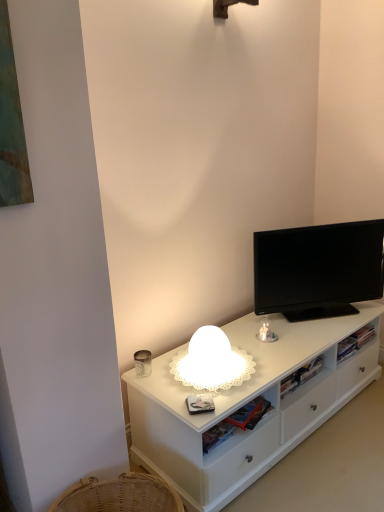
Question: Can you confirm if white matte cabinet at center is taller than white frosted glass lamp at center?

Choices:
 (A) yes
 (B) no

Answer: (B)

Question: Can you confirm if white matte cabinet at center is shorter than white frosted glass lamp at center?

Choices:
 (A) no
 (B) yes

Answer: (B)

Question: Is white frosted glass lamp at center at the back of white matte cabinet at center?

Choices:
 (A) no
 (B) yes

Answer: (A)

Question: From the image's perspective, is white matte cabinet at center above white frosted glass lamp at center?

Choices:
 (A) no
 (B) yes

Answer: (A)

Question: Is white matte cabinet at center wider than white frosted glass lamp at center?

Choices:
 (A) no
 (B) yes

Answer: (B)

Question: Is white matte cabinet at center bigger than white frosted glass lamp at center?

Choices:
 (A) yes
 (B) no

Answer: (A)

Question: Can you confirm if white frosted glass lamp at center is taller than black glossy tv at upper right?

Choices:
 (A) yes
 (B) no

Answer: (B)

Question: Is the depth of white frosted glass lamp at center less than that of black glossy tv at upper right?

Choices:
 (A) no
 (B) yes

Answer: (B)

Question: Is white frosted glass lamp at center not inside black glossy tv at upper right?

Choices:
 (A) no
 (B) yes

Answer: (B)

Question: Can you see white frosted glass lamp at center touching black glossy tv at upper right?

Choices:
 (A) no
 (B) yes

Answer: (A)

Question: Is white frosted glass lamp at center further to the viewer compared to black glossy tv at upper right?

Choices:
 (A) no
 (B) yes

Answer: (A)

Question: From the image's perspective, is white frosted glass lamp at center located above black glossy tv at upper right?

Choices:
 (A) yes
 (B) no

Answer: (B)

Question: Does black glossy tv at upper right come in front of white matte cabinet at center?

Choices:
 (A) yes
 (B) no

Answer: (B)